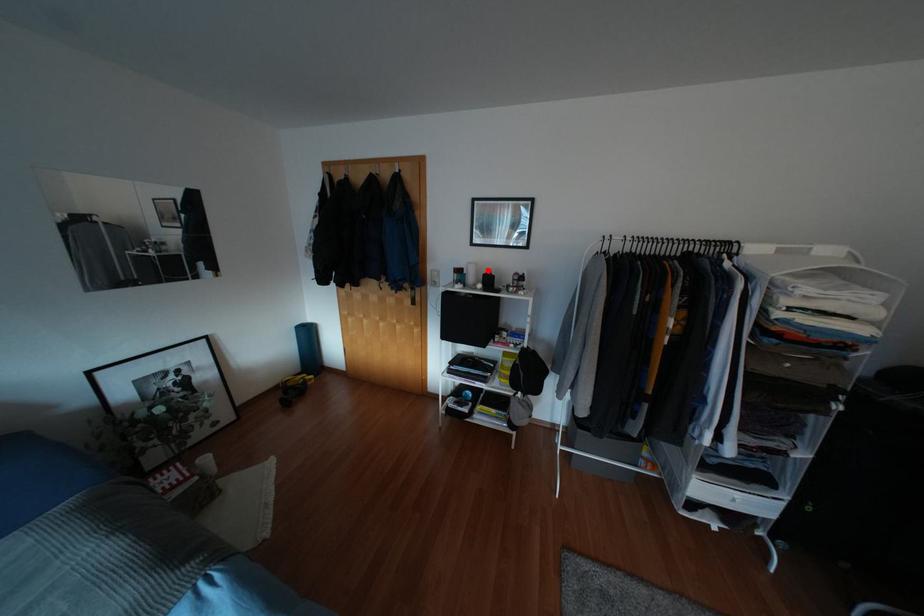
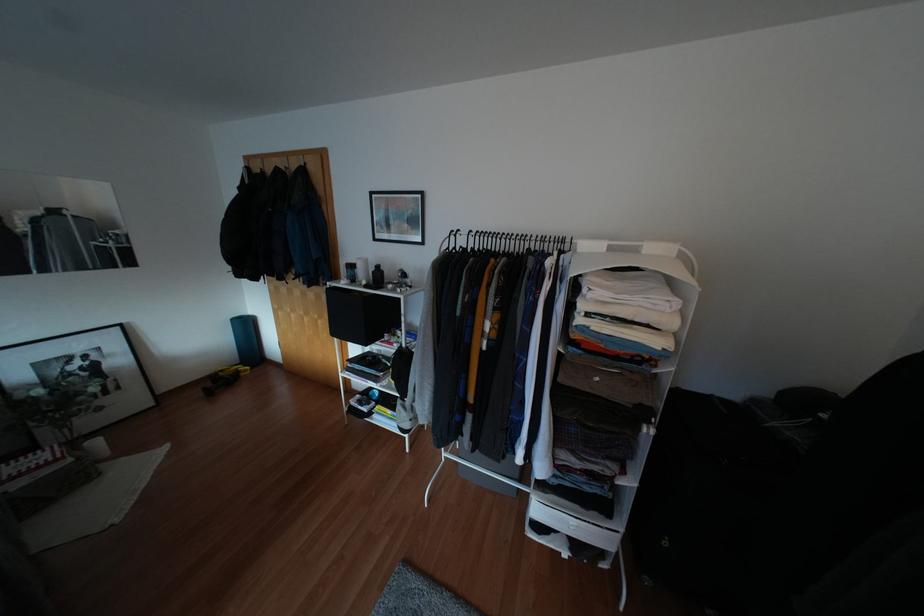
In the second image, find the point that corresponds to the highlighted location in the first image.

(377, 265)